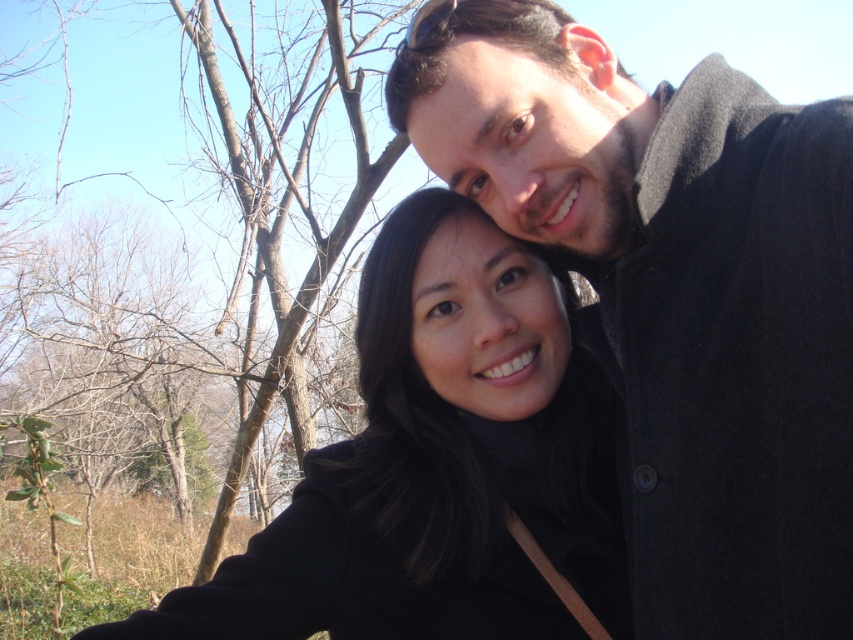
Which is more to the left, dark gray wool coat at upper right or brown leafless tree at left?

brown leafless tree at left

Which is more to the right, dark gray wool coat at upper right or brown leafless tree at left?

From the viewer's perspective, dark gray wool coat at upper right appears more on the right side.

Identify the location of dark gray wool coat at upper right. The image size is (853, 640). (676, 292).

Is black matte coat at center taller than brown leafless tree at left?

In fact, black matte coat at center may be shorter than brown leafless tree at left.

Does black matte coat at center have a lesser width compared to brown leafless tree at left?

Yes, black matte coat at center is thinner than brown leafless tree at left.

Locate an element on the screen. This screenshot has width=853, height=640. black matte coat at center is located at coordinates (440, 467).

This screenshot has height=640, width=853. In order to click on black matte coat at center in this screenshot , I will do `click(440, 467)`.

Is point (692, 364) positioned behind point (521, 428)?

No, (692, 364) is in front of (521, 428).

The width and height of the screenshot is (853, 640). I want to click on dark gray wool coat at upper right, so click(676, 292).

The image size is (853, 640). I want to click on dark gray wool coat at upper right, so click(x=676, y=292).